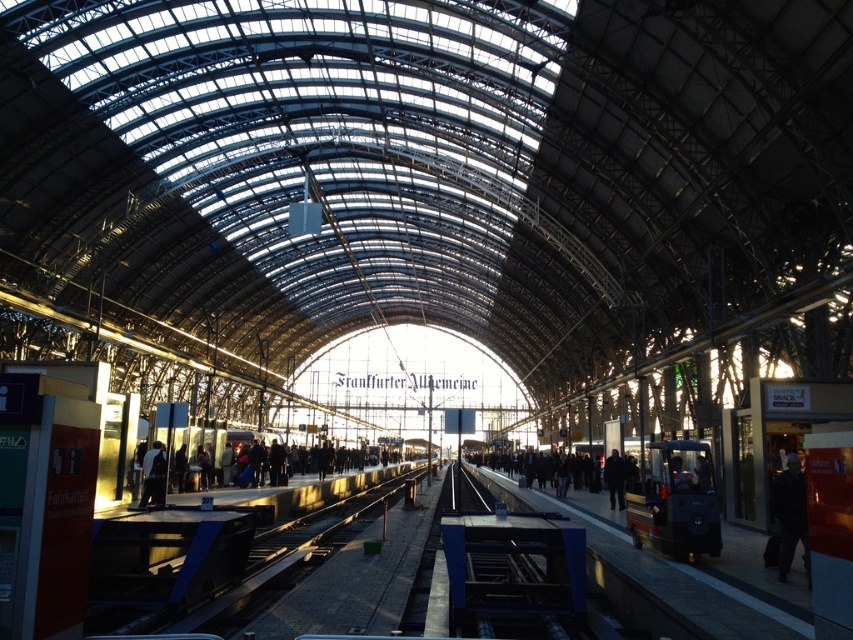
Question: Can you confirm if black fabric person at center is positioned above dark blue jacket at center?

Choices:
 (A) no
 (B) yes

Answer: (A)

Question: Does dark gray jacket at left appear on the left side of dark blue jacket at center?

Choices:
 (A) no
 (B) yes

Answer: (B)

Question: Does dark blue jacket at right come behind dark blue jacket at center?

Choices:
 (A) yes
 (B) no

Answer: (B)

Question: Which is farther from the dark gray jacket at left?

Choices:
 (A) dark blue jacket at right
 (B) dark blue jacket at center
 (C) dark clothing at platform center
 (D) matte black train at right

Answer: (A)

Question: Which of these objects is positioned closest to the dark clothing at platform center?

Choices:
 (A) black fabric person at center
 (B) dark blue jacket at center
 (C) dark blue jacket at right
 (D) dark gray jacket at left

Answer: (D)

Question: Among these objects, which one is farthest from the camera?

Choices:
 (A) black fabric person at center
 (B) dark blue jacket at right
 (C) dark clothing at platform center

Answer: (C)